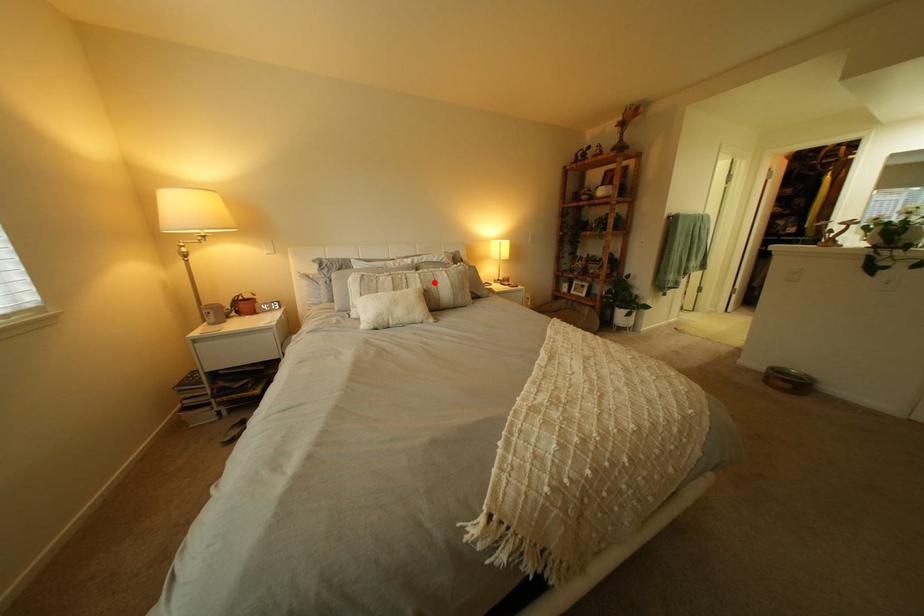
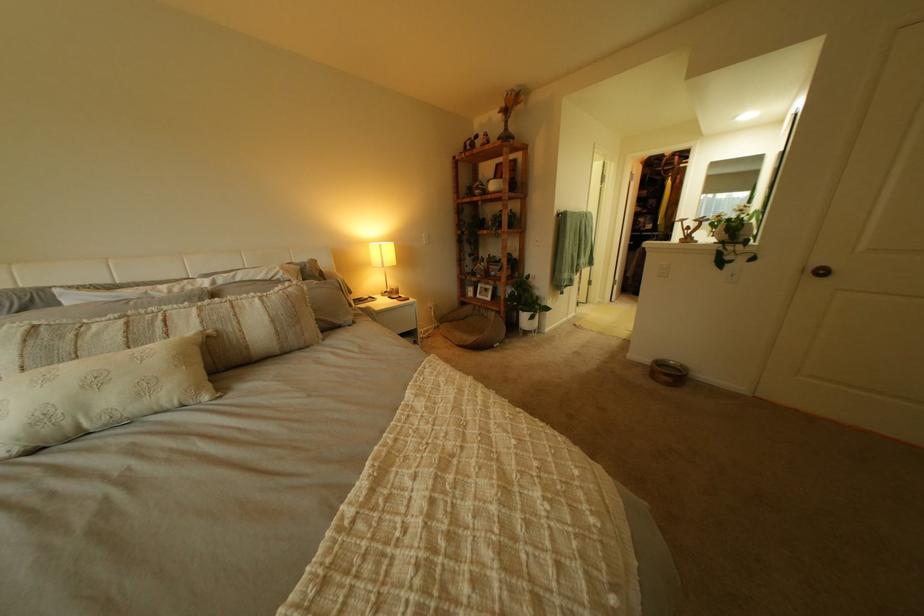
Find the pixel in the second image that matches the highlighted location in the first image.

(213, 323)